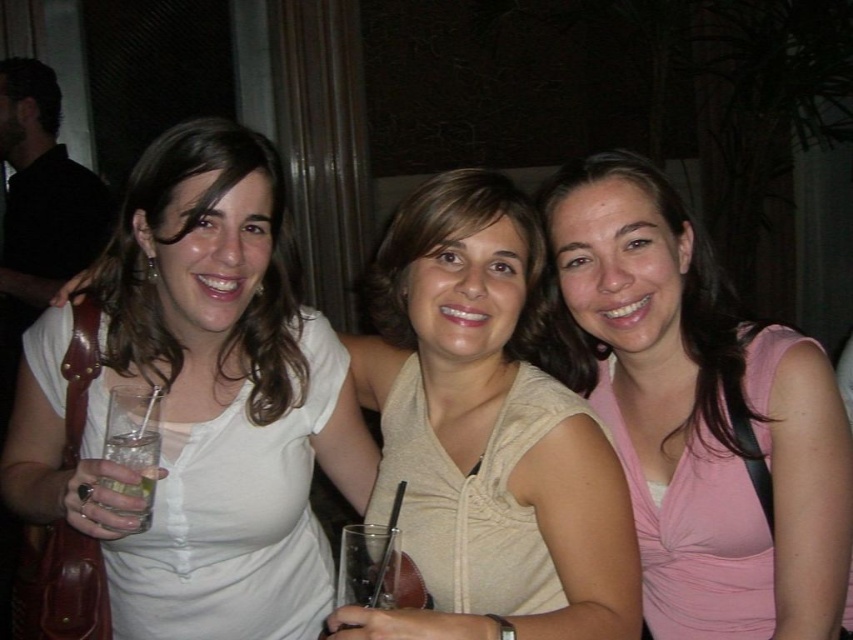
Which of these two, white matte shirt at center or pink satin tank top at center, stands taller?

With more height is white matte shirt at center.

The height and width of the screenshot is (640, 853). Find the location of `white matte shirt at center`. white matte shirt at center is located at coordinates (200, 403).

How distant is beige fabric blouse at center from pink satin tank top at center?

A distance of 20.98 centimeters exists between beige fabric blouse at center and pink satin tank top at center.

Does beige fabric blouse at center appear on the left side of pink satin tank top at center?

Yes, beige fabric blouse at center is to the left of pink satin tank top at center.

Between point (366, 636) and point (556, 193), which one is positioned behind?

Positioned behind is point (556, 193).

Where is `beige fabric blouse at center`? beige fabric blouse at center is located at coordinates 486,433.

Can you confirm if beige fabric blouse at center is bigger than clear glass at left?

Indeed, beige fabric blouse at center has a larger size compared to clear glass at left.

Locate an element on the screen. This screenshot has height=640, width=853. beige fabric blouse at center is located at coordinates (486, 433).

Image resolution: width=853 pixels, height=640 pixels. Find the location of `beige fabric blouse at center`. beige fabric blouse at center is located at coordinates (486, 433).